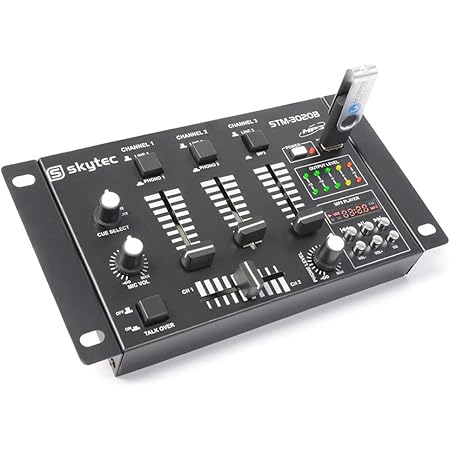
Locate an element on the screen. audio mixer is located at coordinates (207, 210).